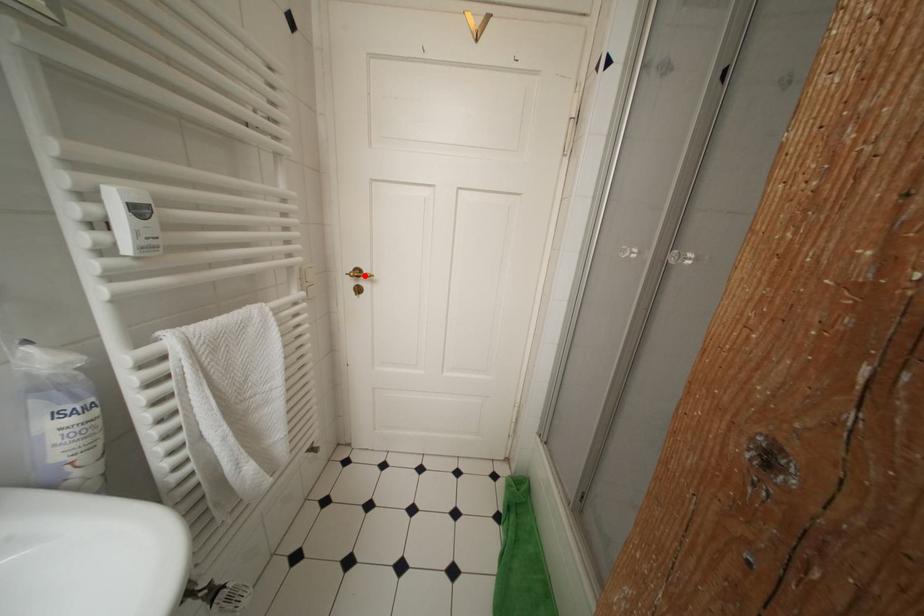
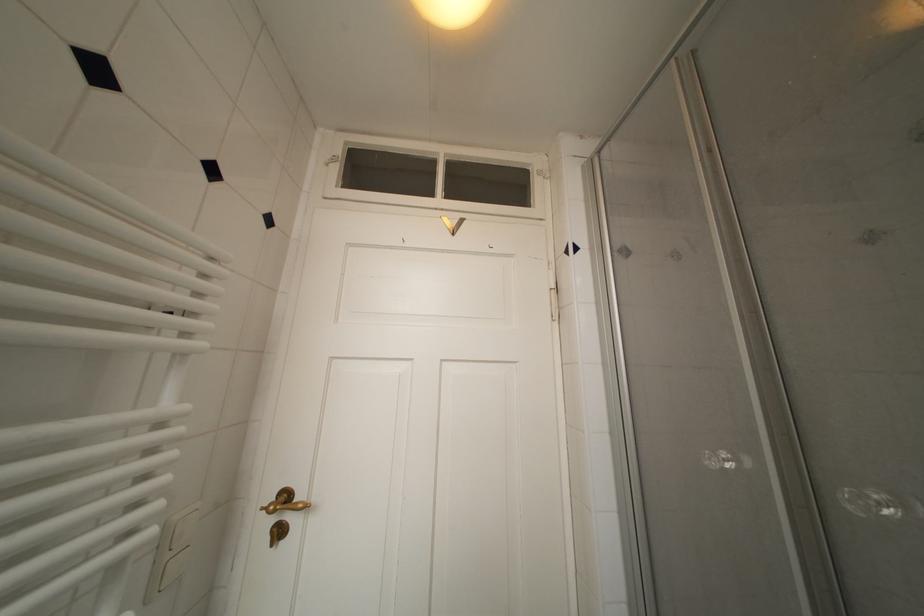
Where in the second image is the point corresponding to the highlighted location from the first image?

(293, 500)